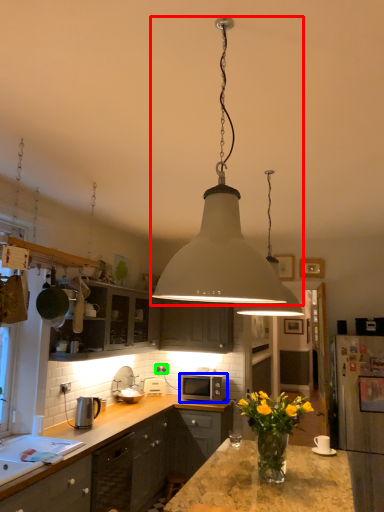
Question: Which object is the farthest from lamp (highlighted by a red box)? Choose among these: microwave oven (highlighted by a blue box) or electric outlet (highlighted by a green box).

Choices:
 (A) microwave oven
 (B) electric outlet

Answer: (B)